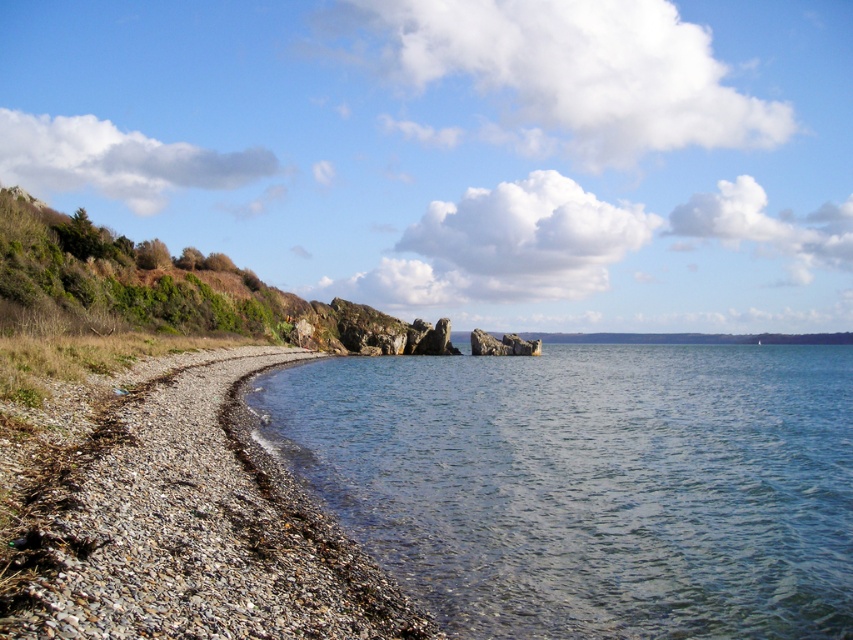
Question: Which point is farther to the camera?

Choices:
 (A) (323, 476)
 (B) (337, 557)

Answer: (A)

Question: Does clear water at lower left have a larger size compared to smooth pebbles at lower left?

Choices:
 (A) yes
 (B) no

Answer: (A)

Question: Among these points, which one is farthest from the camera?

Choices:
 (A) (386, 600)
 (B) (419, 518)

Answer: (B)

Question: From the image, what is the correct spatial relationship of clear water at lower left in relation to smooth pebbles at lower left?

Choices:
 (A) right
 (B) left

Answer: (A)

Question: Can you confirm if clear water at lower left is positioned to the left of smooth pebbles at lower left?

Choices:
 (A) yes
 (B) no

Answer: (B)